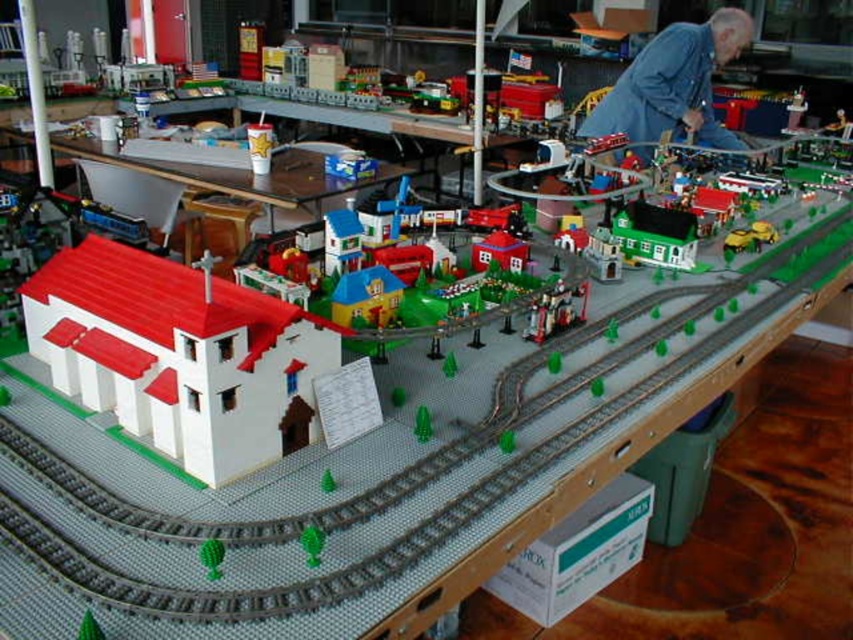
Question: Does white matte building at center have a greater width compared to green plastic cone at lower left?

Choices:
 (A) yes
 (B) no

Answer: (A)

Question: Is the position of white matte church at lower left more distant than that of matte plastic train at center?

Choices:
 (A) no
 (B) yes

Answer: (A)

Question: Is white matte building at center thinner than green matte tree at lower left?

Choices:
 (A) yes
 (B) no

Answer: (B)

Question: Among these objects, which one is nearest to the camera?

Choices:
 (A) green matte ball at lower left
 (B) green matte tree at lower left
 (C) smooth gray train track at center

Answer: (C)

Question: Which point is farther to the camera?

Choices:
 (A) (544, 298)
 (B) (210, 451)
 (C) (318, 528)

Answer: (A)

Question: Among these points, which one is farthest from the camera?

Choices:
 (A) (711, 92)
 (B) (285, 250)
 (C) (682, 268)
 (D) (204, 292)

Answer: (A)